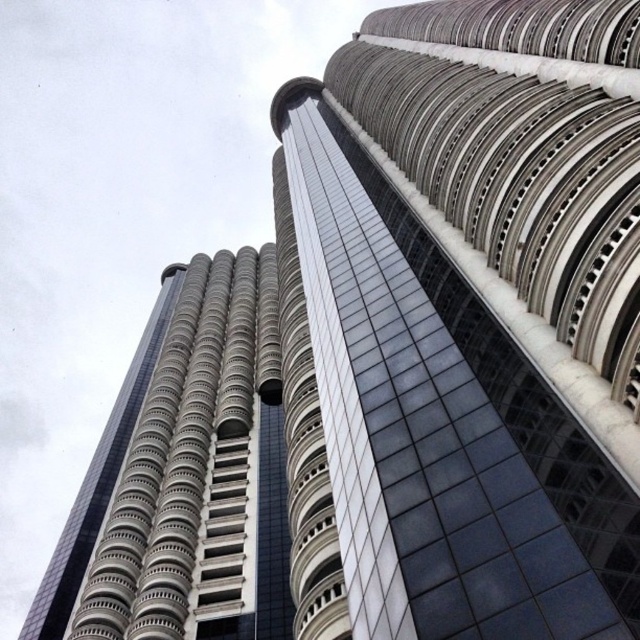
Question: Which object is closer to the camera taking this photo?

Choices:
 (A) silver metallic tower at center
 (B) metallic glass skyscraper at center

Answer: (B)

Question: Among these points, which one is farthest from the camera?

Choices:
 (A) (54, 572)
 (B) (451, 593)

Answer: (A)

Question: Is metallic glass skyscraper at center below silver metallic tower at center?

Choices:
 (A) no
 (B) yes

Answer: (A)

Question: Does metallic glass skyscraper at center have a smaller size compared to silver metallic tower at center?

Choices:
 (A) yes
 (B) no

Answer: (B)

Question: Can you confirm if metallic glass skyscraper at center is positioned to the left of silver metallic tower at center?

Choices:
 (A) yes
 (B) no

Answer: (B)

Question: Among these points, which one is farthest from the camera?

Choices:
 (A) (461, 129)
 (B) (141, 545)

Answer: (B)